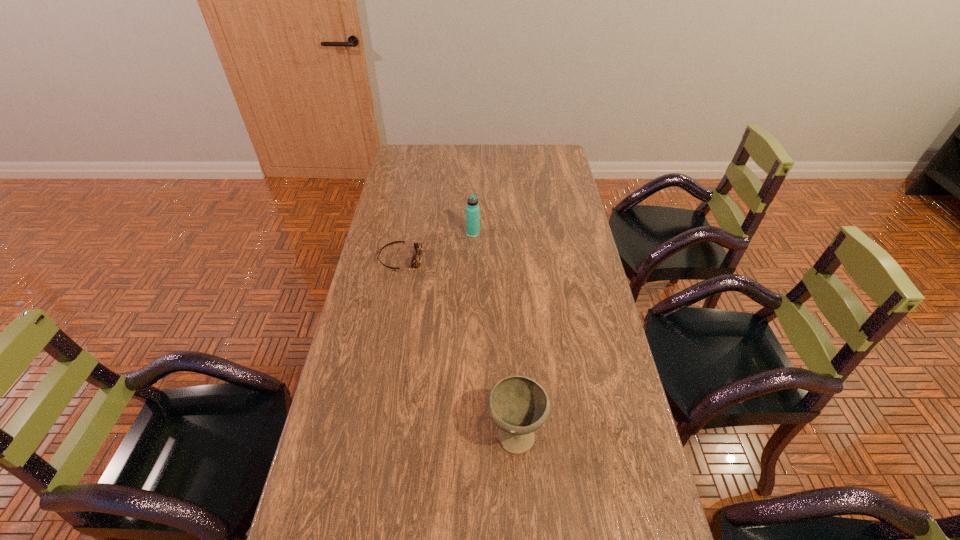
Find the location of a particular element. the second object from right to left is located at coordinates (472, 209).

Where is `thermos bottle`? The image size is (960, 540). thermos bottle is located at coordinates (472, 209).

This screenshot has width=960, height=540. I want to click on the rightmost object, so (517, 405).

At what (x,y) coordinates should I click in order to perform the action: click on the nearest object. Please return your answer as a coordinate pair (x, y). Looking at the image, I should click on (517, 405).

Where is `the second nearest object`? the second nearest object is located at coordinates (415, 262).

Find the location of `the leftmost object`. the leftmost object is located at coordinates (415, 262).

Image resolution: width=960 pixels, height=540 pixels. In order to click on vacant space situated on the back of the farthest object in this screenshot , I will do `click(473, 192)`.

Where is `free spot located on the left of the nearest object`? free spot located on the left of the nearest object is located at coordinates (340, 433).

Identify the location of free space located 0.140m through the lenses of the second nearest object. This screenshot has height=540, width=960. (460, 260).

Where is `object that is at the left edge`? object that is at the left edge is located at coordinates click(x=415, y=262).